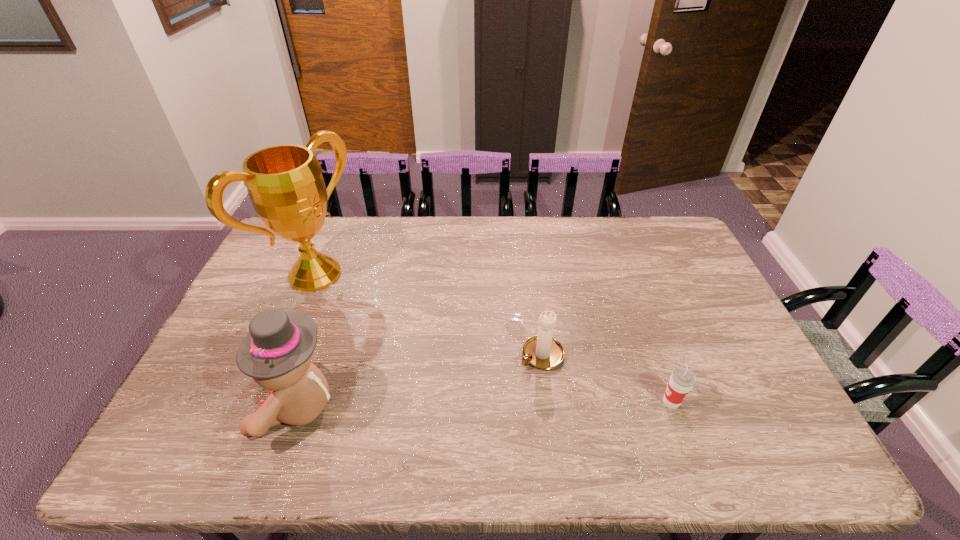
The width and height of the screenshot is (960, 540). I want to click on rag_doll, so click(x=277, y=352).

The image size is (960, 540). Identify the location of the rightmost object. [x=682, y=379].

Where is `the shortest object`? Image resolution: width=960 pixels, height=540 pixels. the shortest object is located at coordinates (682, 379).

Image resolution: width=960 pixels, height=540 pixels. Find the location of `the farthest object`. the farthest object is located at coordinates (285, 184).

This screenshot has width=960, height=540. Identify the location of award. (285, 184).

This screenshot has height=540, width=960. I want to click on candle holder, so click(x=543, y=352).

Where is `free point located on the front-facing side of the third shortest object`? This screenshot has height=540, width=960. free point located on the front-facing side of the third shortest object is located at coordinates (227, 407).

Identify the location of vacant space located 0.170m on the front-facing side of the third shortest object. The width and height of the screenshot is (960, 540). (186, 407).

The height and width of the screenshot is (540, 960). What are the coordinates of `blank space located 0.080m on the front-facing side of the third shortest object` in the screenshot? It's located at (223, 407).

In order to click on vacant space located on the side of the cup with the logo in this screenshot , I will do `click(569, 402)`.